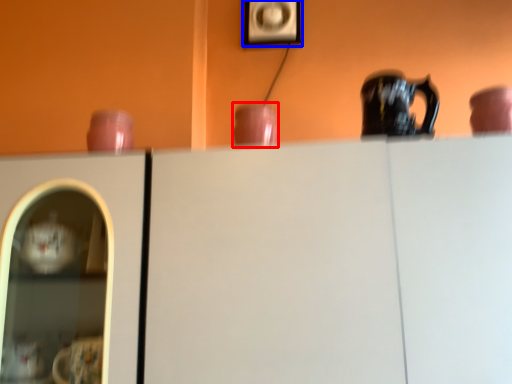
Question: Among these objects, which one is nearest to the camera, tableware (highlighted by a red box) or picture frame (highlighted by a blue box)?

Choices:
 (A) tableware
 (B) picture frame

Answer: (A)